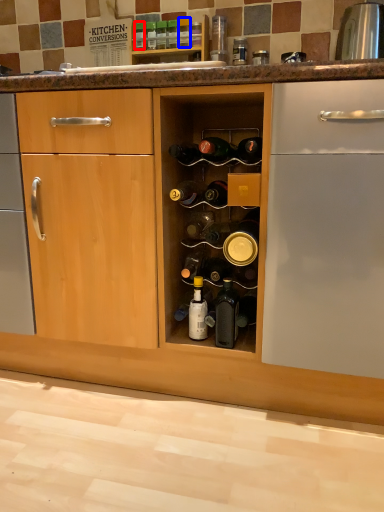
Question: Which object appears closest to the camera in this image, bottle (highlighted by a red box) or bottle (highlighted by a blue box)?

Choices:
 (A) bottle
 (B) bottle

Answer: (B)